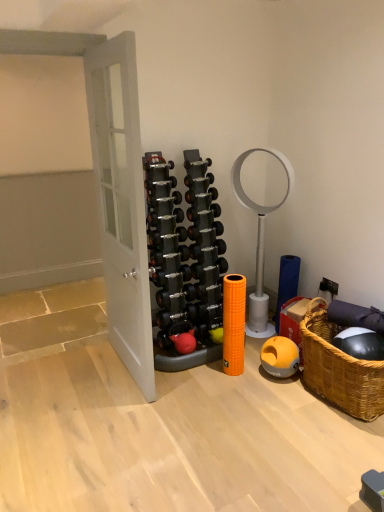
Question: Would you say black rubber dumbbell at center, the 8th dumbbell positioned from the top, is outside silver metallic dumbbell at center, which is counted as the third dumbbell, starting from the top?

Choices:
 (A) yes
 (B) no

Answer: (A)

Question: Is black rubber dumbbell at center, the 8th dumbbell positioned from the top, touching silver metallic dumbbell at center, which is counted as the third dumbbell, starting from the top?

Choices:
 (A) no
 (B) yes

Answer: (A)

Question: From the image's perspective, is black rubber dumbbell at center, the 8th dumbbell positioned from the top, on top of silver metallic dumbbell at center, which is the 14th dumbbell in bottom-to-top order?

Choices:
 (A) yes
 (B) no

Answer: (B)

Question: Is silver metallic dumbbell at center, which is counted as the third dumbbell, starting from the top, located within black rubber dumbbell at center, arranged as the 9th dumbbell when ordered from the bottom?

Choices:
 (A) no
 (B) yes

Answer: (A)

Question: Is black rubber dumbbell at center, the 8th dumbbell positioned from the top, behind silver metallic dumbbell at center, which is counted as the third dumbbell, starting from the top?

Choices:
 (A) yes
 (B) no

Answer: (B)

Question: From a real-world perspective, is orange rubber dumbbell at center, the 12th dumbbell positioned from the top, physically located above or below silver metallic dumbbell at center, which is counted as the third dumbbell, starting from the top?

Choices:
 (A) below
 (B) above

Answer: (A)

Question: From the image's perspective, relative to silver metallic dumbbell at center, which is the 14th dumbbell in bottom-to-top order, is orange rubber dumbbell at center, the 12th dumbbell positioned from the top, above or below?

Choices:
 (A) above
 (B) below

Answer: (B)

Question: Is orange rubber dumbbell at center, which ranks as the fifth dumbbell in bottom-to-top order, taller or shorter than silver metallic dumbbell at center, which is the 14th dumbbell in bottom-to-top order?

Choices:
 (A) tall
 (B) short

Answer: (A)

Question: Considering their positions, is orange rubber dumbbell at center, which ranks as the fifth dumbbell in bottom-to-top order, located in front of or behind silver metallic dumbbell at center, which is counted as the third dumbbell, starting from the top?

Choices:
 (A) behind
 (B) front

Answer: (A)

Question: Considering the positions of black rubber dumbbell at center, which ranks as the fourth dumbbell in bottom-to-top order, and black rubber dumbbell at center, the twelfth dumbbell from the bottom, in the image, is black rubber dumbbell at center, which ranks as the fourth dumbbell in bottom-to-top order, taller or shorter than black rubber dumbbell at center, the twelfth dumbbell from the bottom,?

Choices:
 (A) short
 (B) tall

Answer: (B)

Question: From the image's perspective, relative to black rubber dumbbell at center, marked as the 5th dumbbell in a top-to-bottom arrangement, is black rubber dumbbell at center, which ranks as the fourth dumbbell in bottom-to-top order, above or below?

Choices:
 (A) above
 (B) below

Answer: (B)

Question: Looking at their shapes, would you say black rubber dumbbell at center, which ranks as the fourth dumbbell in bottom-to-top order, is wider or thinner than black rubber dumbbell at center, marked as the 5th dumbbell in a top-to-bottom arrangement?

Choices:
 (A) wide
 (B) thin

Answer: (A)

Question: Would you say black rubber dumbbell at center, which ranks as the fourth dumbbell in bottom-to-top order, is to the left or to the right of black rubber dumbbell at center, marked as the 5th dumbbell in a top-to-bottom arrangement, in the picture?

Choices:
 (A) right
 (B) left

Answer: (B)

Question: Visually, is black rubber dumbbell at center, the tenth dumbbell from the bottom, positioned to the left or to the right of black rubber dumbbell at center, which is the fourteenth dumbbell in top-to-bottom order?

Choices:
 (A) left
 (B) right

Answer: (B)

Question: Is black rubber dumbbell at center, the tenth dumbbell from the bottom, in front of or behind black rubber dumbbell at center, which is the fourteenth dumbbell in top-to-bottom order, in the image?

Choices:
 (A) behind
 (B) front

Answer: (A)